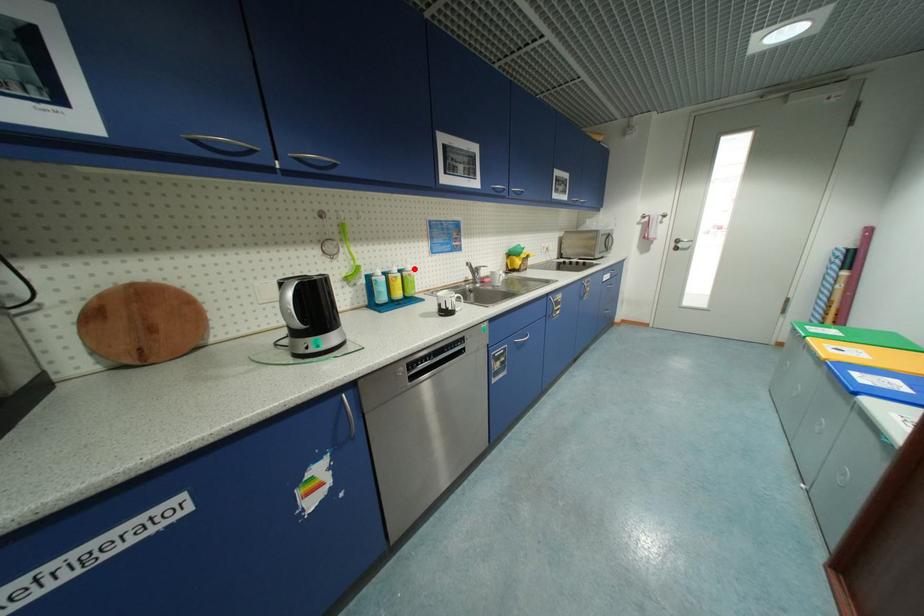
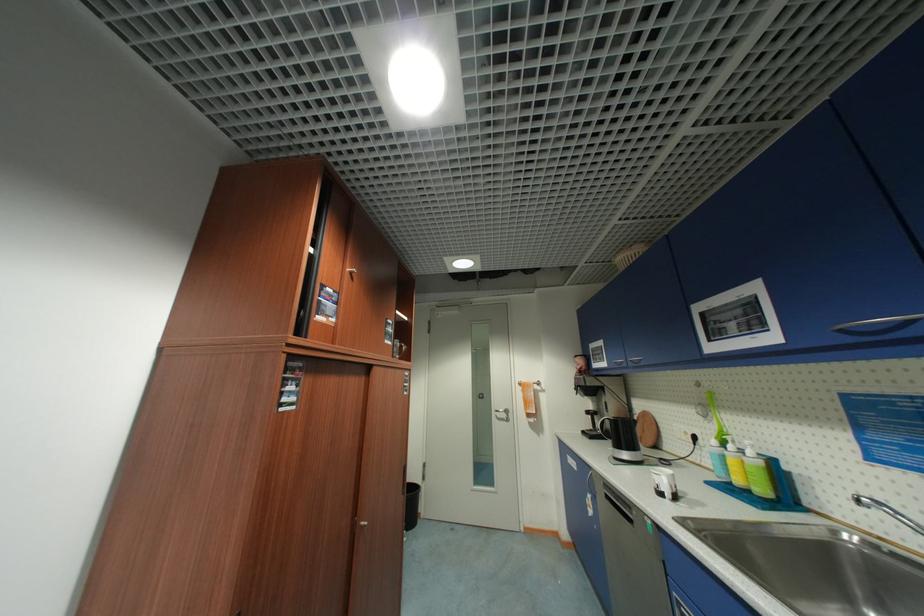
In the second image, find the point that corresponds to the highlighted location in the first image.

(756, 454)